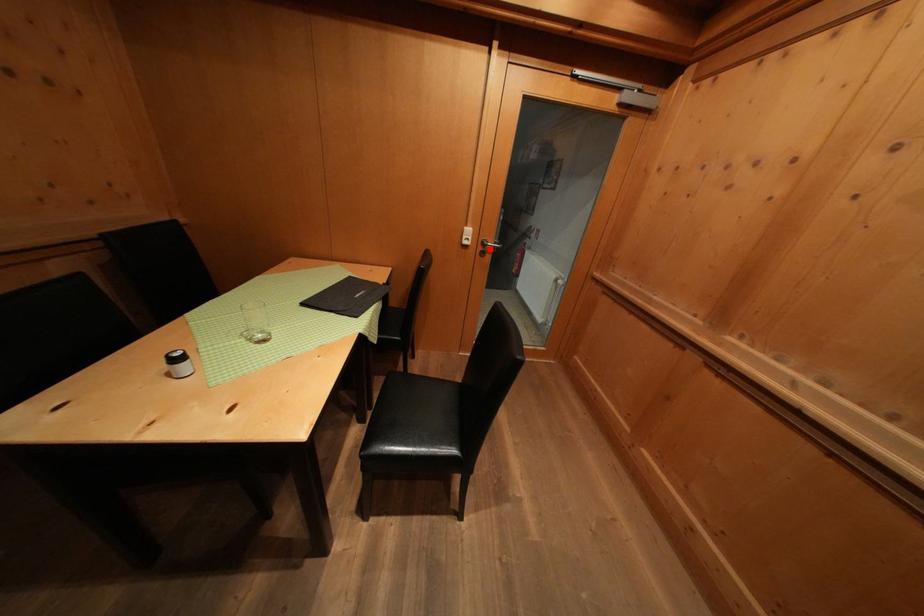
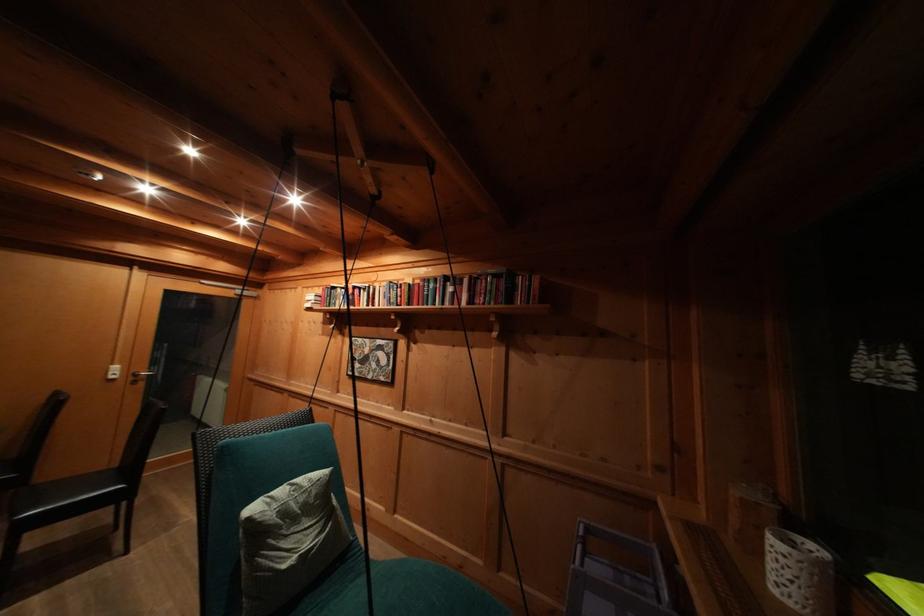
Locate, in the second image, the point that corresponds to the highlighted location in the first image.

(141, 379)